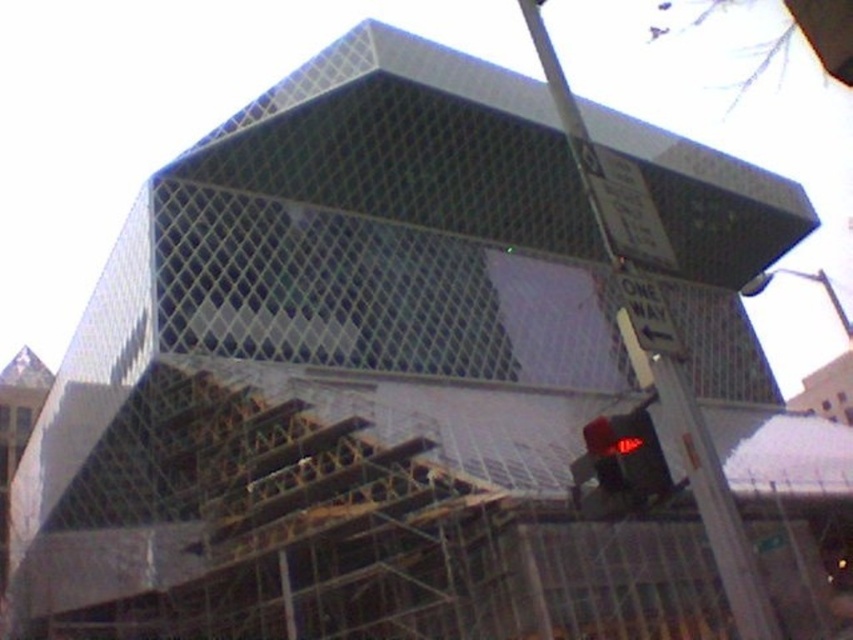
Who is higher up, metallic pole at right or white plastic street sign at right?

Positioned higher is metallic pole at right.

Is metallic pole at right thinner than white plastic street sign at right?

No.

Locate an element on the screen. The image size is (853, 640). metallic pole at right is located at coordinates (714, 502).

Is point (578, 112) positioned before point (598, 429)?

No, (578, 112) is further to viewer.

Who is lower down, metallic pole at right or red glass traffic light at lower right?

red glass traffic light at lower right is below.

Looking at this image, who is more forward, (715, 524) or (587, 502)?

Positioned in front is point (587, 502).

Where is `metallic pole at right`? metallic pole at right is located at coordinates (714, 502).

Is red glass traffic light at lower right thinner than white plastic street sign at right?

No.

Does red glass traffic light at lower right have a greater width compared to white plastic street sign at right?

Indeed, red glass traffic light at lower right has a greater width compared to white plastic street sign at right.

Find the location of a particular element. red glass traffic light at lower right is located at coordinates (619, 467).